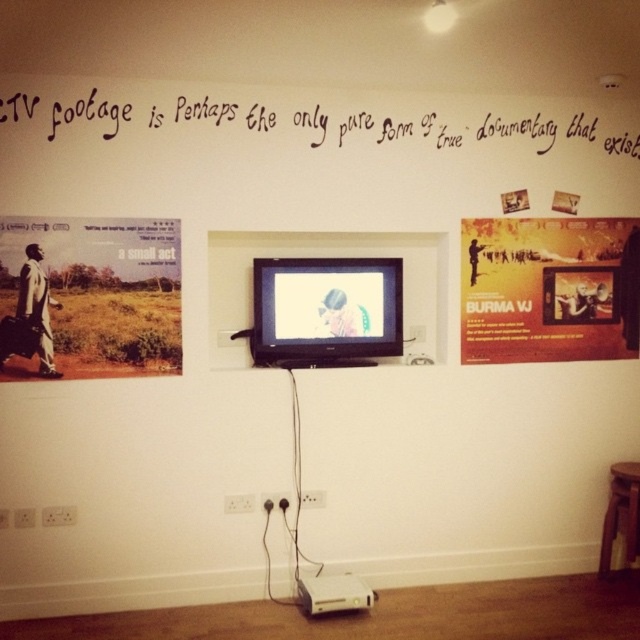
What is the relationship in size between the black calligraphy at upper center and the brown wooden stool at lower right?

The black calligraphy at upper center is larger in size than the brown wooden stool at lower right.

What is the 2D coordinate of the matte cardboard poster at left?

The matte cardboard poster at left is located at the point with coordinates 0.464 in the x axis and 0.141 in the y axis.

You are an interior designer planning to hang a new picture frame that measures 0.3 meters in width. You need to place it between the matte cardboard poster at left and the TV. Based on the coordinates provided in the Objects Description, will there be enough space for the frame?

The matte cardboard poster at left is located at point (90,296). Since the coordinates indicate its position relative to the TV, there should be sufficient space between them to accommodate the 0.3 meters wide picture frame.